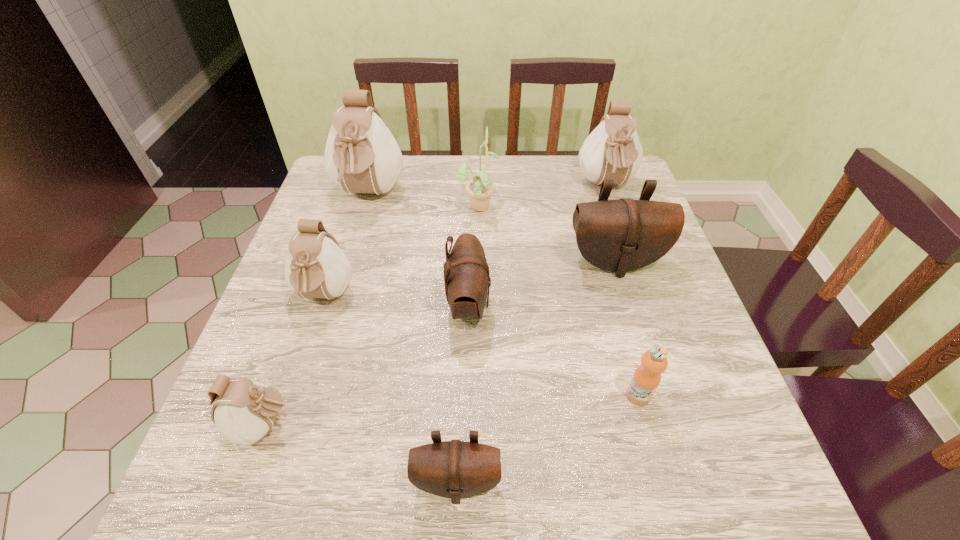
Locate an element on the screen. the fifth closest object relative to the yellow sunflower is located at coordinates (316, 267).

Image resolution: width=960 pixels, height=540 pixels. Find the location of `pouch that stands as the third closest to the second biggest brown pouch`. pouch that stands as the third closest to the second biggest brown pouch is located at coordinates (361, 155).

The image size is (960, 540). Identify the location of pouch identified as the fifth closest to the nearest brown pouch. (361, 155).

Identify the location of the second closest white pouch to the second smallest white pouch. (361, 155).

Identify the location of white pouch that stands as the second closest to the nearest brown pouch. (316, 267).

Point out which brown pouch is positioned as the nearest to the nearest pouch. Please provide its 2D coordinates. Your answer should be formatted as a tuple, i.e. [(x, y)], where the tuple contains the x and y coordinates of a point satisfying the conditions above.

[(466, 273)]

Identify which brown pouch is the second nearest to the sunflower. Please provide its 2D coordinates. Your answer should be formatted as a tuple, i.e. [(x, y)], where the tuple contains the x and y coordinates of a point satisfying the conditions above.

[(466, 273)]

Identify the location of vacant space that satisfies the following two spatial constraints: 1. on the front-facing side of the rightmost white pouch; 2. with the flap open on the second biggest brown pouch. (647, 305).

Image resolution: width=960 pixels, height=540 pixels. In order to click on vacant space that satisfies the following two spatial constraints: 1. with the flap open on the biggest brown pouch; 2. with the flap open on the second smallest brown pouch in this screenshot , I will do `click(628, 305)`.

Where is `free location that satisfies the following two spatial constraints: 1. on the front-facing side of the second biggest white pouch; 2. on the front-facing side of the smallest white pouch`? The image size is (960, 540). free location that satisfies the following two spatial constraints: 1. on the front-facing side of the second biggest white pouch; 2. on the front-facing side of the smallest white pouch is located at coordinates (689, 426).